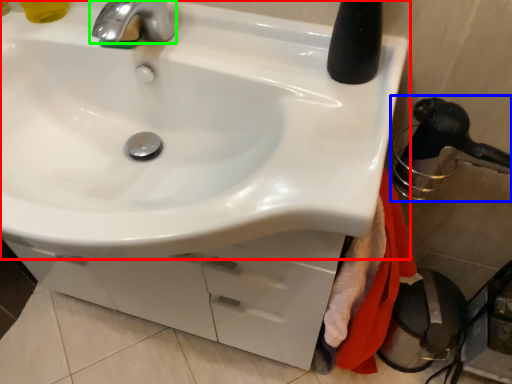
Question: Estimate the real-world distances between objects in this image. Which object is closer to sink (highlighted by a red box), shower (highlighted by a blue box) or tap (highlighted by a green box)?

Choices:
 (A) shower
 (B) tap

Answer: (B)